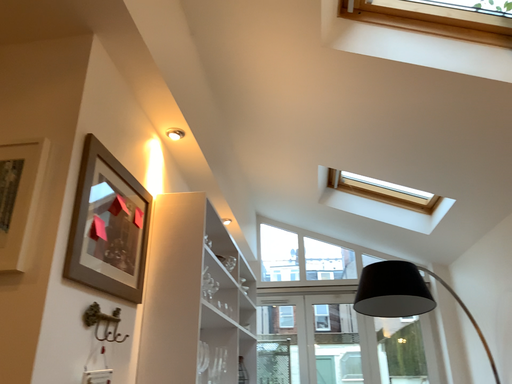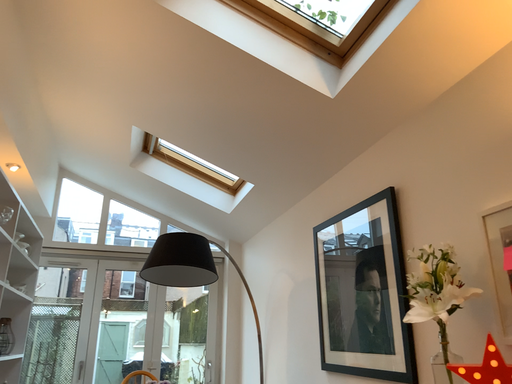
Question: Which way did the camera rotate in the video?

Choices:
 (A) rotated left
 (B) rotated right

Answer: (B)